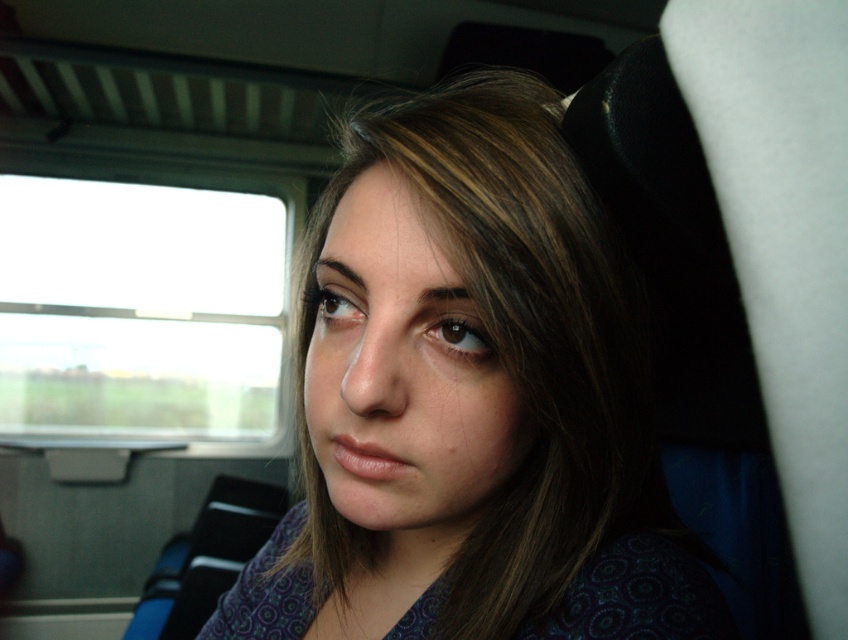
From the picture: You are sitting in the train and want to place a small item on the seat. You have two points to choose from, point (484, 182) and point (95, 408). Which point is closer to you?

Point (484, 182) is in front of point (95, 408), so it is closer to you.

You are a passenger sitting in a train seat. You have a matte purple shirt at center and a transparent glass window at left in your view. Which object is shorter in height?

The matte purple shirt at center has a lesser height compared to the transparent glass window at left, so the matte purple shirt at center is shorter in height.